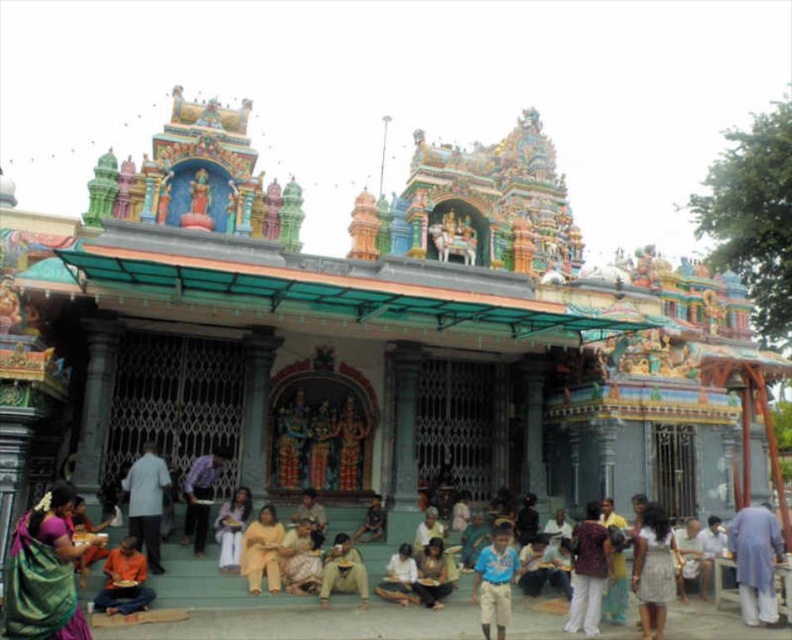
You are standing at the entrance of the temple and want to reach the point marked by point [743,600] and point [366,602]. Based on their positions, which point is closer to you?

Point [743,600] is in front of point [366,602], so it is closer to you.

You are a photographer standing in front of the temple. You want to capture a photo that includes both the light blue fabric at lower right and the brown cotton pants at center. Which object should you adjust your camera angle to focus on first to ensure both are in frame?

The light blue fabric at lower right is located above the brown cotton pants at center, so you should first focus on the light blue fabric at lower right to ensure the lower positioned brown cotton pants at center remains in frame.